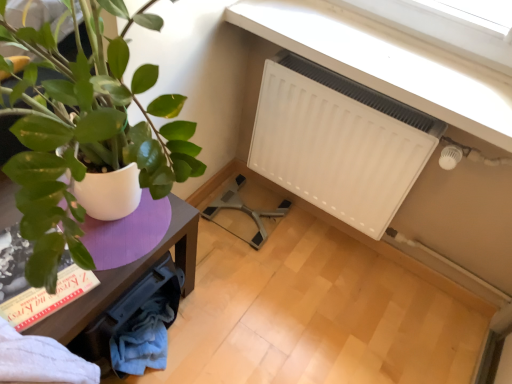
Question: Is purple wood table at left with white matte radiator at upper right?

Choices:
 (A) no
 (B) yes

Answer: (A)

Question: Can you confirm if purple wood table at left is wider than white matte radiator at upper right?

Choices:
 (A) yes
 (B) no

Answer: (A)

Question: Is purple wood table at left not near white matte radiator at upper right?

Choices:
 (A) yes
 (B) no

Answer: (B)

Question: From the image's perspective, is purple wood table at left above white matte radiator at upper right?

Choices:
 (A) no
 (B) yes

Answer: (A)

Question: Considering the relative sizes of purple wood table at left and white matte radiator at upper right in the image provided, is purple wood table at left bigger than white matte radiator at upper right?

Choices:
 (A) no
 (B) yes

Answer: (B)

Question: Is purple wood table at left wider or thinner than white matte radiator at upper right?

Choices:
 (A) thin
 (B) wide

Answer: (B)

Question: Is purple wood table at left taller or shorter than white matte radiator at upper right?

Choices:
 (A) tall
 (B) short

Answer: (B)

Question: Visually, is purple wood table at left positioned to the left or to the right of white matte radiator at upper right?

Choices:
 (A) left
 (B) right

Answer: (A)

Question: Which is correct: purple wood table at left is inside white matte radiator at upper right, or outside of it?

Choices:
 (A) inside
 (B) outside

Answer: (B)

Question: In the image, is white matte radiator at upper right positioned in front of or behind purple wood table at left?

Choices:
 (A) front
 (B) behind

Answer: (B)

Question: Is white matte radiator at upper right inside or outside of purple wood table at left?

Choices:
 (A) inside
 (B) outside

Answer: (B)

Question: Considering the positions of point (295, 124) and point (129, 284), is point (295, 124) closer or farther from the camera than point (129, 284)?

Choices:
 (A) closer
 (B) farther

Answer: (B)

Question: In terms of size, does white matte radiator at upper right appear bigger or smaller than purple wood table at left?

Choices:
 (A) big
 (B) small

Answer: (B)

Question: Based on their positions, is purple wood table at left located to the left or right of white plastic radiator at upper right?

Choices:
 (A) right
 (B) left

Answer: (B)

Question: From a real-world perspective, is purple wood table at left above or below white plastic radiator at upper right?

Choices:
 (A) below
 (B) above

Answer: (A)